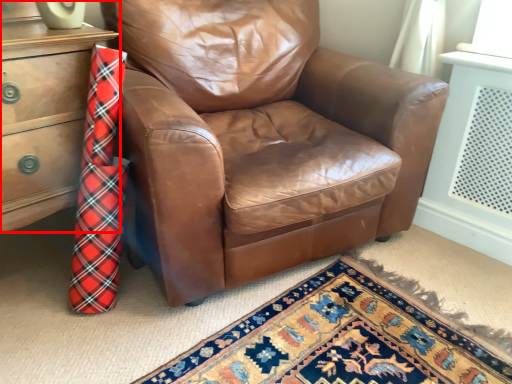
Question: In this image, where is chest of drawers (annotated by the red box) located relative to chair?

Choices:
 (A) right
 (B) left

Answer: (B)